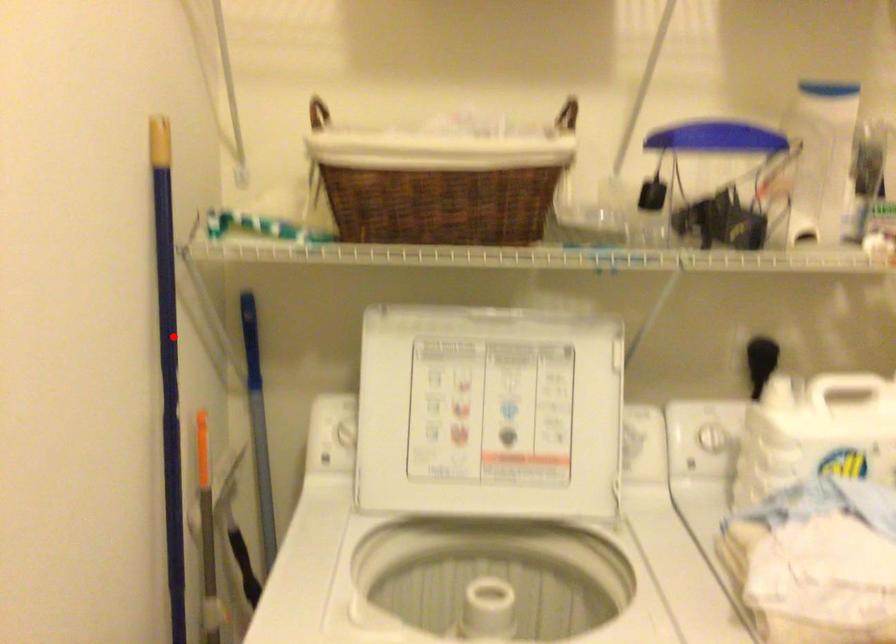
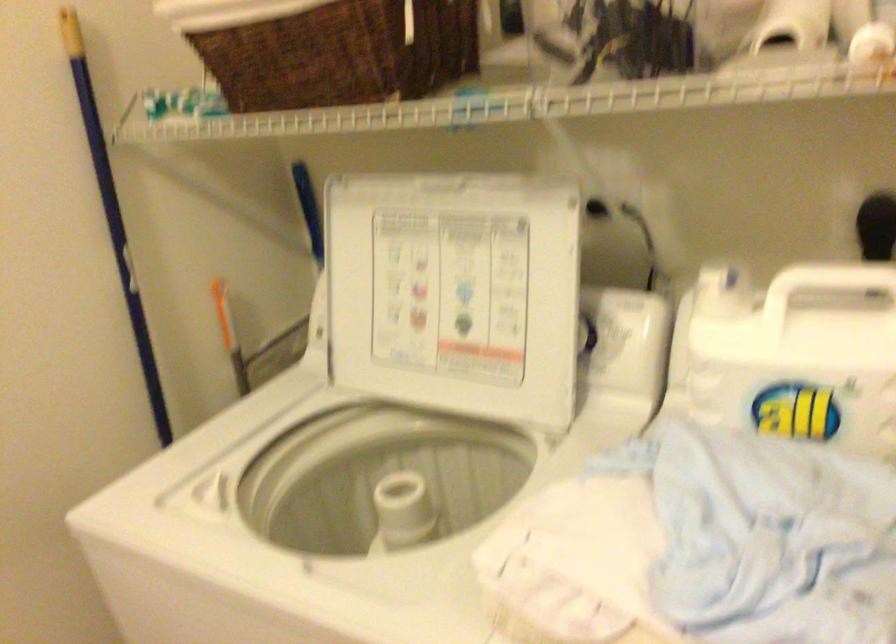
Question: I am providing you with two images of the same scene from different viewpoints. A red point is marked on the first image. Can you still see the location of the red point in image 2?

Choices:
 (A) Yes
 (B) No

Answer: (A)